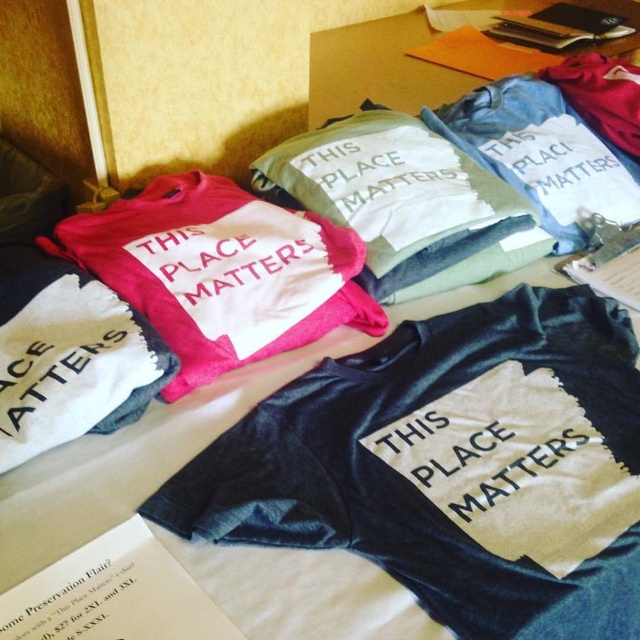
Question: Does black cotton t-shirt at center have a larger size compared to matte pink t-shirt at center?

Choices:
 (A) no
 (B) yes

Answer: (B)

Question: Can you confirm if black cotton t-shirt at center is smaller than matte pink t-shirt at center?

Choices:
 (A) no
 (B) yes

Answer: (A)

Question: Can you confirm if black cotton t-shirt at center is bigger than matte pink t-shirt at center?

Choices:
 (A) yes
 (B) no

Answer: (A)

Question: Which point is farther to the camera?

Choices:
 (A) (538, 524)
 (B) (100, 225)
 (C) (621, 166)

Answer: (C)

Question: Among these points, which one is farthest from the camera?

Choices:
 (A) (557, 220)
 (B) (170, 180)

Answer: (A)

Question: Which is farther from the matte pink t-shirt at center?

Choices:
 (A) blue cotton jeans at upper right
 (B) black cotton t-shirt at center

Answer: (A)